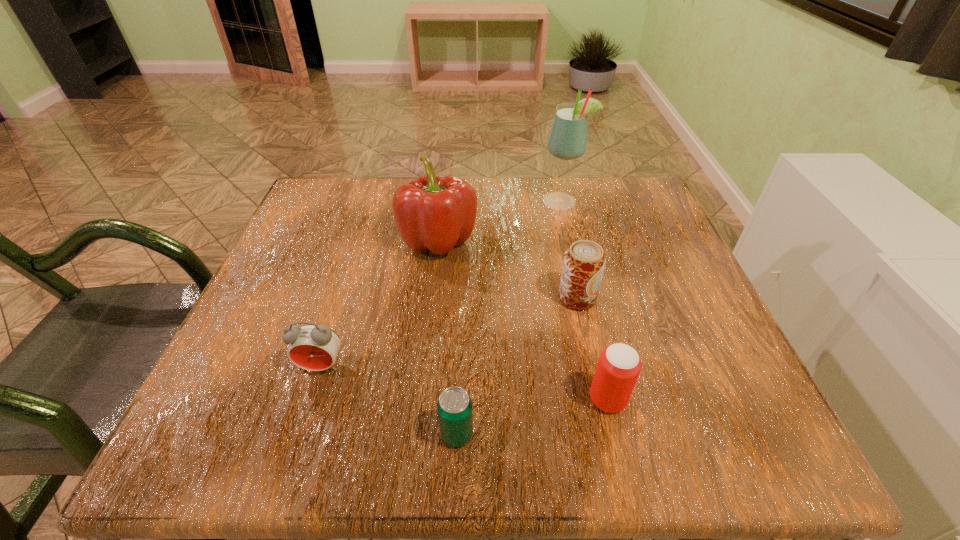
In order to click on free space between the alcohol and the alarm clock in this screenshot , I will do `click(442, 284)`.

This screenshot has height=540, width=960. Find the location of `free space between the leftmost beer can and the alcohol`. free space between the leftmost beer can and the alcohol is located at coordinates (509, 318).

The image size is (960, 540). In order to click on empty space that is in between the tallest object and the nearest beer can in this screenshot , I will do click(509, 318).

You are a GUI agent. You are given a task and a screenshot of the screen. Output one action in this format:
    pyautogui.click(x=<x>, y=<y>)
    Task: Click on the blank region between the alcohol and the second farthest object
    The height and width of the screenshot is (540, 960).
    Given the screenshot: What is the action you would take?
    pyautogui.click(x=500, y=221)

Identify the location of vacant space that is in between the second nearest object and the leftmost object. The height and width of the screenshot is (540, 960). (465, 383).

Locate which object is the fifth closest to the alcohol. Please provide its 2D coordinates. Your answer should be formatted as a tuple, i.e. [(x, y)], where the tuple contains the x and y coordinates of a point satisfying the conditions above.

[(313, 347)]

Identify the location of the fourth closest object to the fourth farthest object. (619, 365).

You are a GUI agent. You are given a task and a screenshot of the screen. Output one action in this format:
    pyautogui.click(x=<x>, y=<y>)
    Task: Click on the beer can that is the second closest to the second farthest object
    Image resolution: width=960 pixels, height=540 pixels.
    Given the screenshot: What is the action you would take?
    pyautogui.click(x=619, y=365)

Select which beer can is the closest to the second nearest beer can. Please provide its 2D coordinates. Your answer should be formatted as a tuple, i.e. [(x, y)], where the tuple contains the x and y coordinates of a point satisfying the conditions above.

[(584, 262)]

This screenshot has height=540, width=960. Identify the location of vacant area in the image that satisfies the following two spatial constraints: 1. on the face of the shortest object; 2. on the right side of the alarm clock. (300, 434).